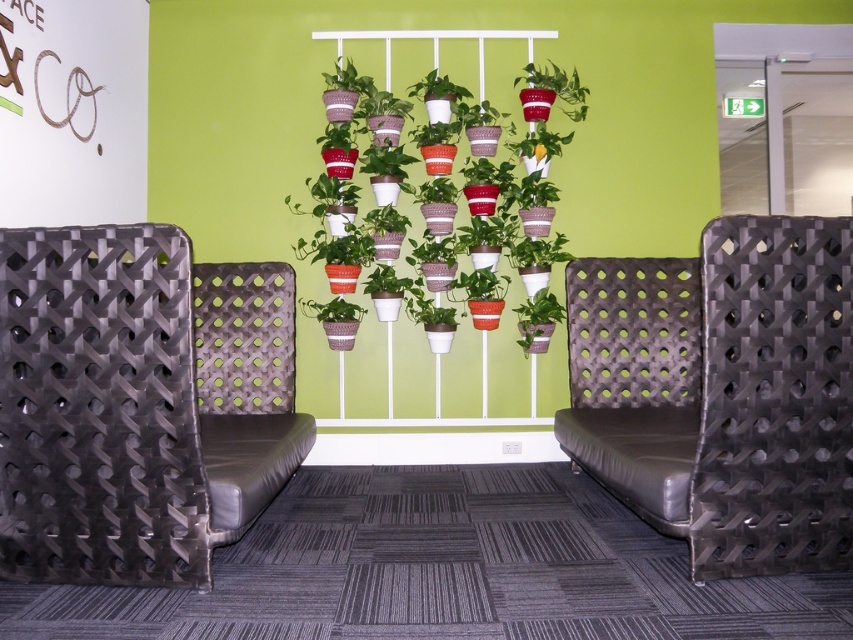
Who is shorter, black woven fabric chair at left or black leather chair at center?

With less height is black woven fabric chair at left.

Who is more distant from viewer, (184, 465) or (671, 316)?

The point (671, 316) is more distant.

This screenshot has height=640, width=853. Describe the element at coordinates (138, 403) in the screenshot. I see `black woven fabric chair at left` at that location.

I want to click on black woven fabric chair at left, so click(x=138, y=403).

Who is lower down, black woven fabric chair at left or green matte plant at center?

black woven fabric chair at left is below.

What do you see at coordinates (138, 403) in the screenshot? The image size is (853, 640). I see `black woven fabric chair at left` at bounding box center [138, 403].

Between point (18, 433) and point (546, 321), which one is positioned in front?

Point (18, 433) is more forward.

The image size is (853, 640). What are the coordinates of `black woven fabric chair at left` in the screenshot? It's located at (138, 403).

Is black leather chair at center wider than matte red pot at upper center?

Yes.

Is black leather chair at center bigger than matte red pot at upper center?

Yes.

Consider the image. Measure the distance between black leather chair at center and camera.

6.69 feet

This screenshot has height=640, width=853. Identify the location of black leather chair at center. click(x=722, y=392).